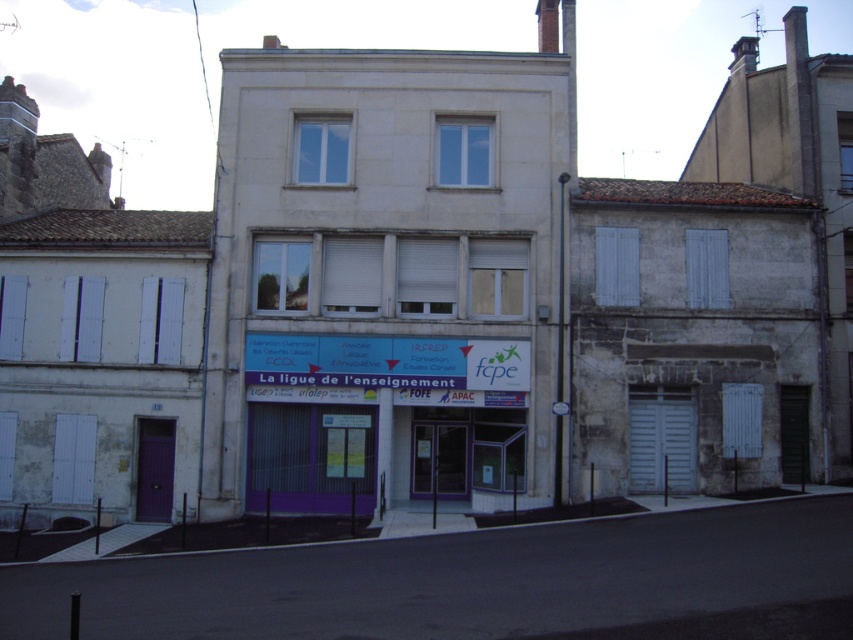
Question: Observing the image, what is the correct spatial positioning of white stone building at center in reference to purple matte signboard at center?

Choices:
 (A) below
 (B) above

Answer: (B)

Question: Which of the following is the farthest from the observer?

Choices:
 (A) white stone building at center
 (B) purple matte signboard at center

Answer: (B)

Question: Which point appears farthest from the camera in this image?

Choices:
 (A) (273, 124)
 (B) (421, 352)

Answer: (A)

Question: Does white stone building at center have a smaller size compared to purple matte signboard at center?

Choices:
 (A) yes
 (B) no

Answer: (B)

Question: Is white stone building at center positioned behind purple matte signboard at center?

Choices:
 (A) yes
 (B) no

Answer: (B)

Question: Which object appears farthest from the camera in this image?

Choices:
 (A) purple matte signboard at center
 (B) white stone building at center

Answer: (A)